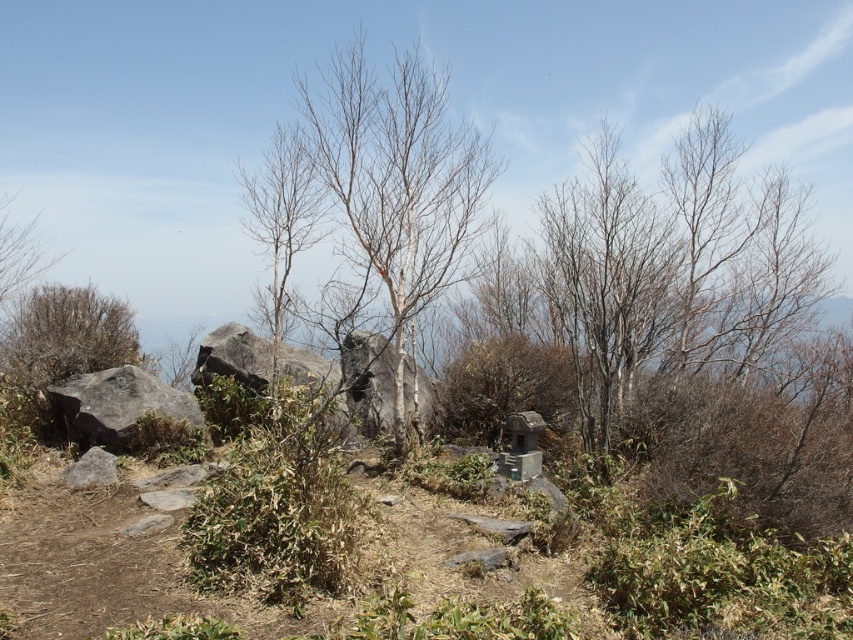
You are a hiker who wants to place a small backpack between the brown shrub at left and the gray rough boulder at left. Can you fit the backpack between them if the backpack is 1 meter wide?

The brown shrub at left is wider than the gray rough boulder at left, so the space between them may be too narrow to fit a 1 meter wide backpack.

You are a hiker trying to navigate through the dirt path in the scene. You need to decide whether to walk around the gray rough boulder at left or the bare branches at left first. Based on their widths, which one should you go around first?

The gray rough boulder at left is thinner than the bare branches at left, so you should go around the gray rough boulder at left first since it is narrower and requires less space to navigate around.